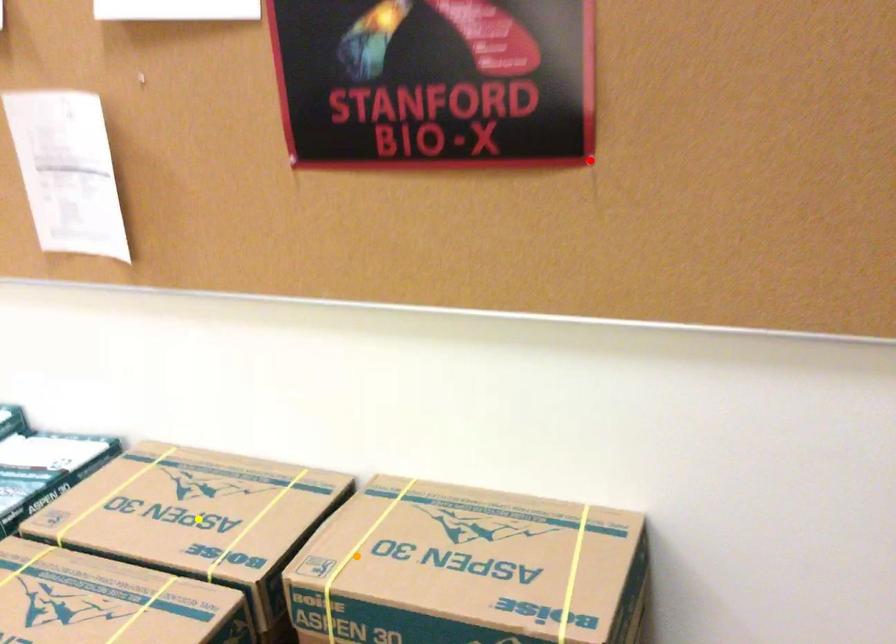
Order these from farthest to nearest:
A) yellow point
B) red point
C) orange point

yellow point → orange point → red point